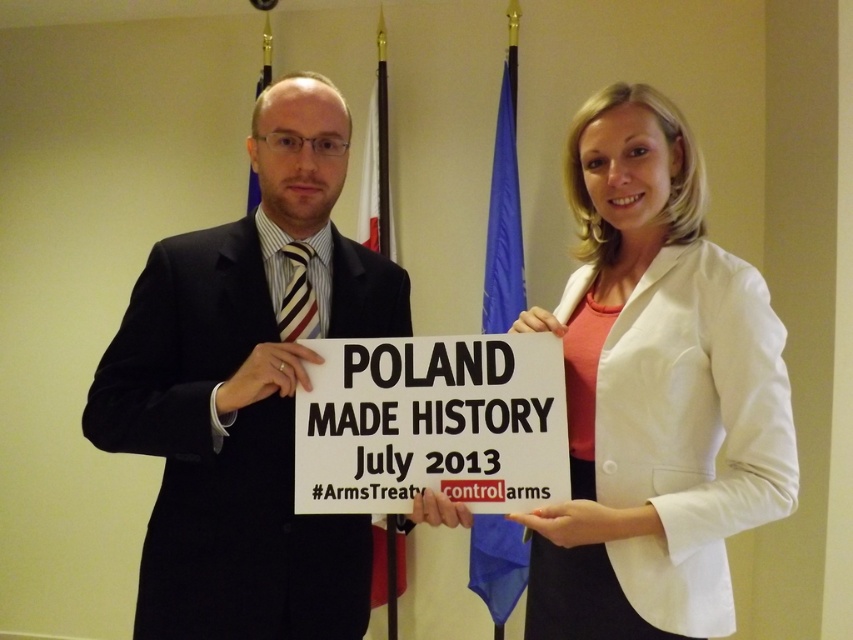
Please provide the coordinates of the white matte blazer at center in the image. The answer should be in the format of coordinates in parentheses. The scene is two people holding a sign, with the man in a dark suit on the left and the woman in a white blazer on the right.

The white matte blazer at center is located at coordinates point (654, 392).

You are a photographer at the event and need to frame a closeup shot of the black suit at center and the white paper sign at center. Given that your camera can only focus on objects wider than 30cm, can both objects be in focus?

The black suit at center is wider than the white paper sign at center. Since the camera requires objects to be wider than 30cm to focus, and the black suit at center is wider than the white paper sign at center, it depends on whether the white paper sign at center is at least 30cm. However, without knowing the exact width of the sign, we cannot confirm if both are above the 30cm threshold. The information provided only states the relative sizes between the two objects.

You are a photographer who wants to take a picture of the black suit at center and the white paper sign at center. Which object should you focus on first if you want to capture both clearly in the frame?

The black suit at center is bigger than the white paper sign at center, so you should focus on the black suit at center first to ensure both are in focus since larger objects often require more precise focusing to capture details clearly.